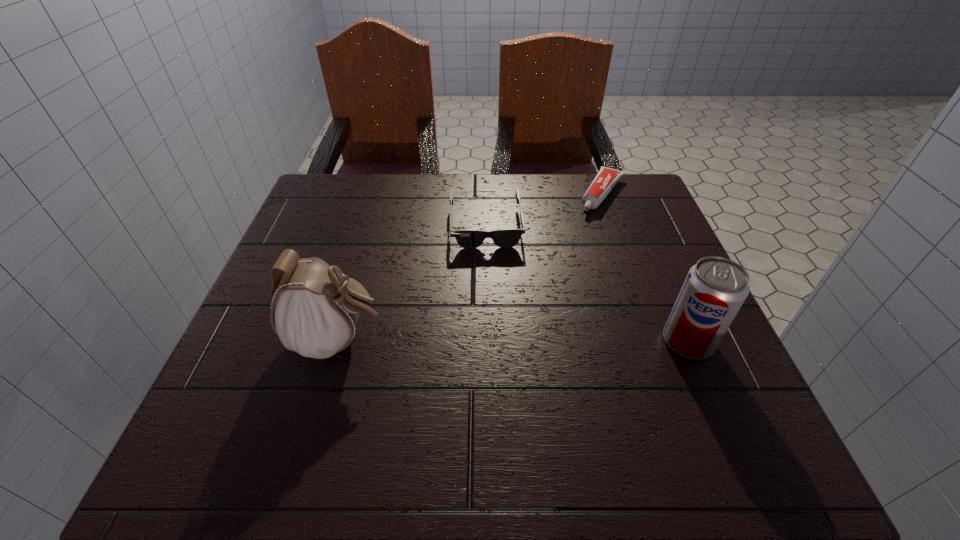
At what (x,y) coordinates should I click in order to perform the action: click on pouch. Please return your answer as a coordinate pair (x, y). This screenshot has height=540, width=960. Looking at the image, I should click on (314, 312).

You are a GUI agent. You are given a task and a screenshot of the screen. Output one action in this format:
    pyautogui.click(x=<x>, y=<y>)
    Task: Click on the second tallest object
    
    Given the screenshot: What is the action you would take?
    pyautogui.click(x=715, y=288)

You are a GUI agent. You are given a task and a screenshot of the screen. Output one action in this format:
    pyautogui.click(x=<x>, y=<y>)
    Task: Click on the third tallest object
    The height and width of the screenshot is (540, 960).
    Given the screenshot: What is the action you would take?
    pyautogui.click(x=467, y=238)

Find the location of `the third object from right to left`. the third object from right to left is located at coordinates (467, 238).

The height and width of the screenshot is (540, 960). I want to click on toothpaste, so click(x=606, y=179).

Where is `free point located on the front-facing side of the pouch`? free point located on the front-facing side of the pouch is located at coordinates (429, 341).

This screenshot has height=540, width=960. In order to click on vacant space situated on the left of the third shortest object in this screenshot , I will do `click(473, 342)`.

Where is `vacant space situated 0.270m on the temples of the third tallest object`? This screenshot has height=540, width=960. vacant space situated 0.270m on the temples of the third tallest object is located at coordinates pos(493,344).

Locate an element on the screen. The height and width of the screenshot is (540, 960). vacant region located on the temples of the third tallest object is located at coordinates (495, 362).

Locate an element on the screen. free space located on the temples of the third tallest object is located at coordinates (491, 298).